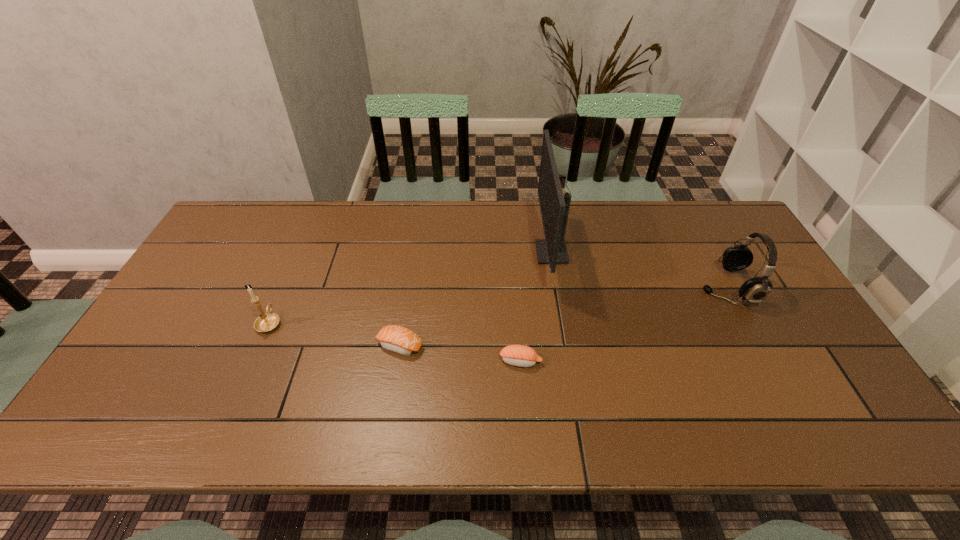
Locate an element on the screen. the second object from right to left is located at coordinates (554, 207).

The image size is (960, 540). I want to click on computer monitor, so click(x=554, y=207).

Find the location of a particular element. headset is located at coordinates (755, 290).

Locate an element on the screen. the rightmost object is located at coordinates (755, 290).

You are a GUI agent. You are given a task and a screenshot of the screen. Output one action in this format:
    pyautogui.click(x=<x>, y=<y>)
    Task: Click on the leftmost object
    
    Given the screenshot: What is the action you would take?
    pyautogui.click(x=266, y=322)

Locate an element on the screen. This screenshot has width=960, height=540. candle holder is located at coordinates (266, 322).

Identify the location of the right sushi. The height and width of the screenshot is (540, 960). (518, 355).

At what (x,y) coordinates should I click in order to perform the action: click on the fourth object from right to left. Please return your answer as a coordinate pair (x, y). The image size is (960, 540). Looking at the image, I should click on (398, 339).

At what (x,y) coordinates should I click in order to perform the action: click on vacant area situated on the front-facing side of the second object from right to left. Please return your answer as a coordinate pair (x, y). The height and width of the screenshot is (540, 960). Looking at the image, I should click on (489, 253).

The image size is (960, 540). I want to click on vacant region located 0.150m on the front-facing side of the second object from right to left, so click(x=489, y=253).